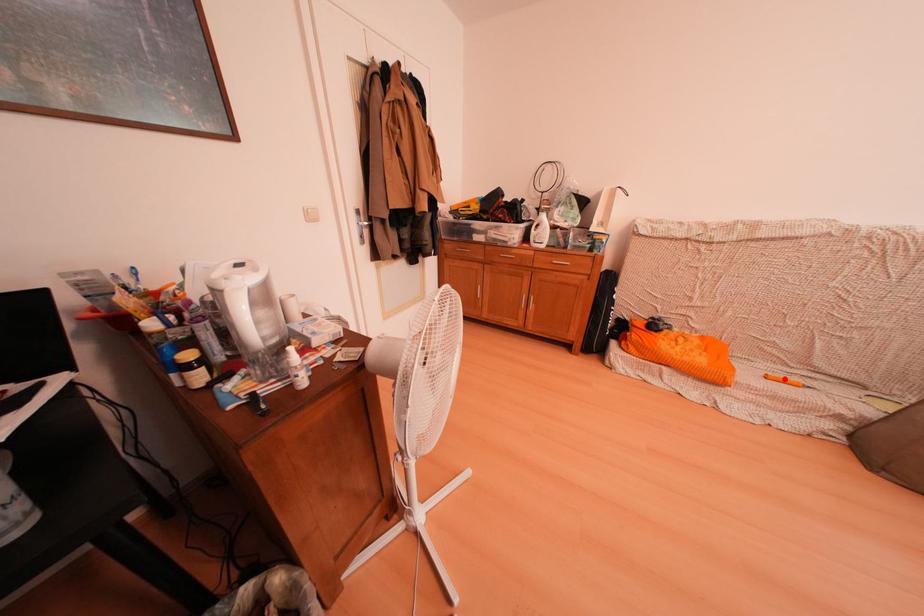
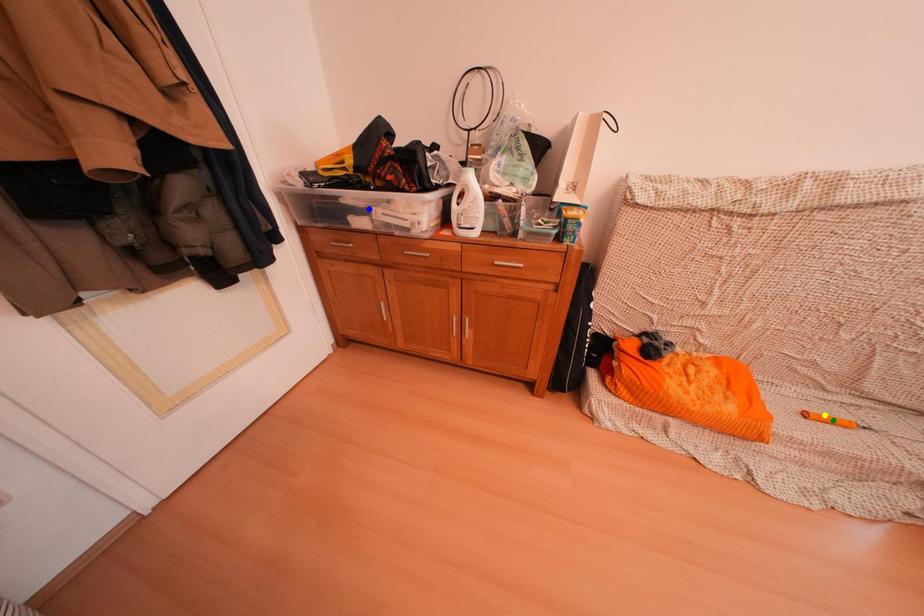
Question: I am providing you with two images of the same scene from different viewpoints. A red point is marked on the first image. You are given multiple points on the second image. Which spot in image 2 lines up with the point in image 1?

Choices:
 (A) blue point
 (B) yellow point
 (C) green point

Answer: (B)